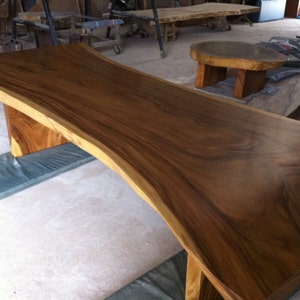
Where is `plywood`? plywood is located at coordinates click(x=97, y=4), click(x=54, y=6).